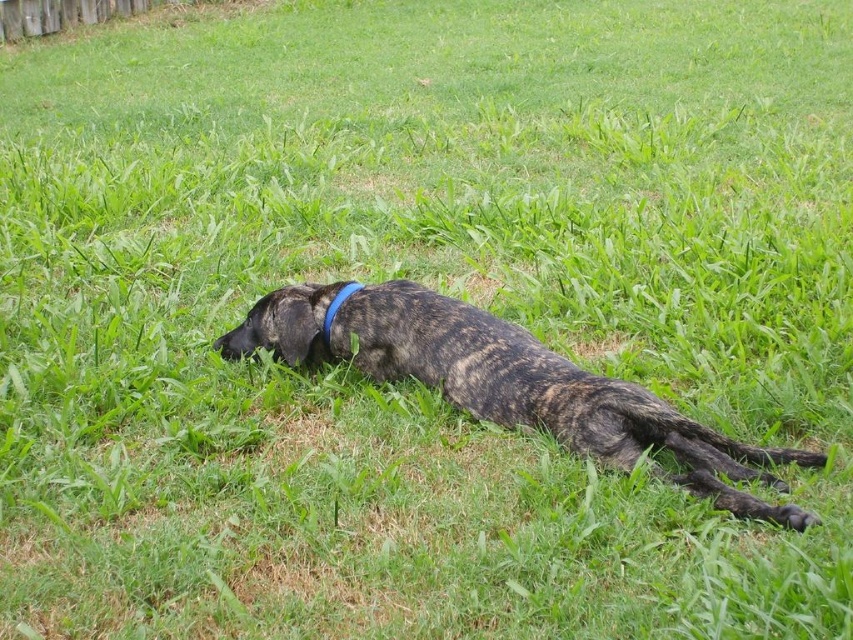
Consider the image. Does brindle fur dog at center appear under blue fabric neckband at center?

Yes, brindle fur dog at center is below blue fabric neckband at center.

Who is shorter, brindle fur dog at center or blue fabric neckband at center?

blue fabric neckband at center is shorter.

Describe the element at coordinates (508, 381) in the screenshot. I see `brindle fur dog at center` at that location.

Where is `brindle fur dog at center`? The image size is (853, 640). brindle fur dog at center is located at coordinates (508, 381).